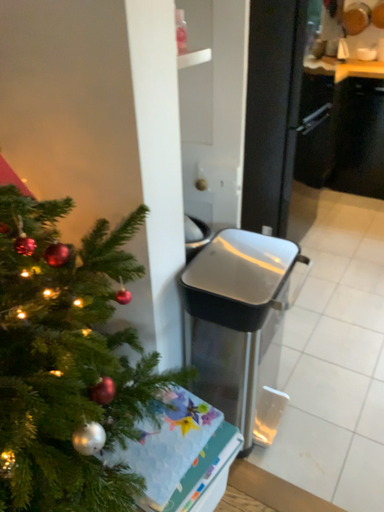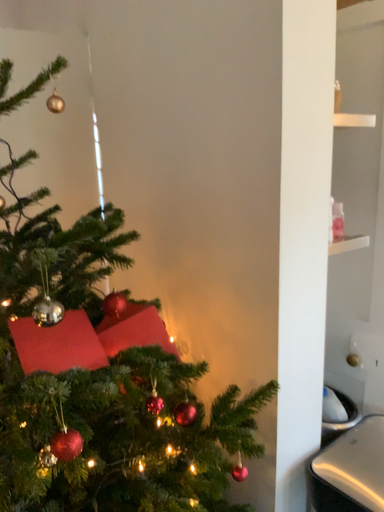
Question: How did the camera likely rotate when shooting the video?

Choices:
 (A) rotated right
 (B) rotated left

Answer: (B)